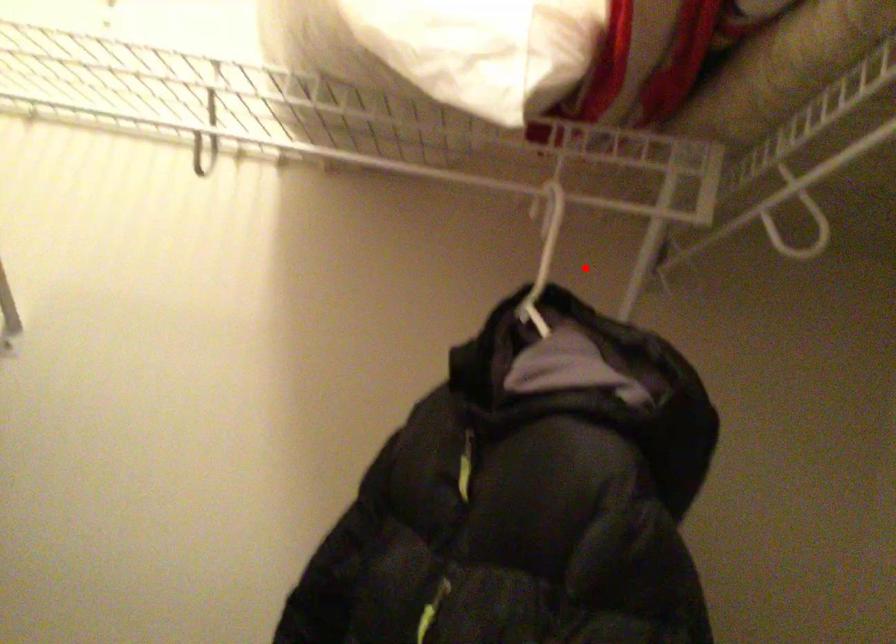
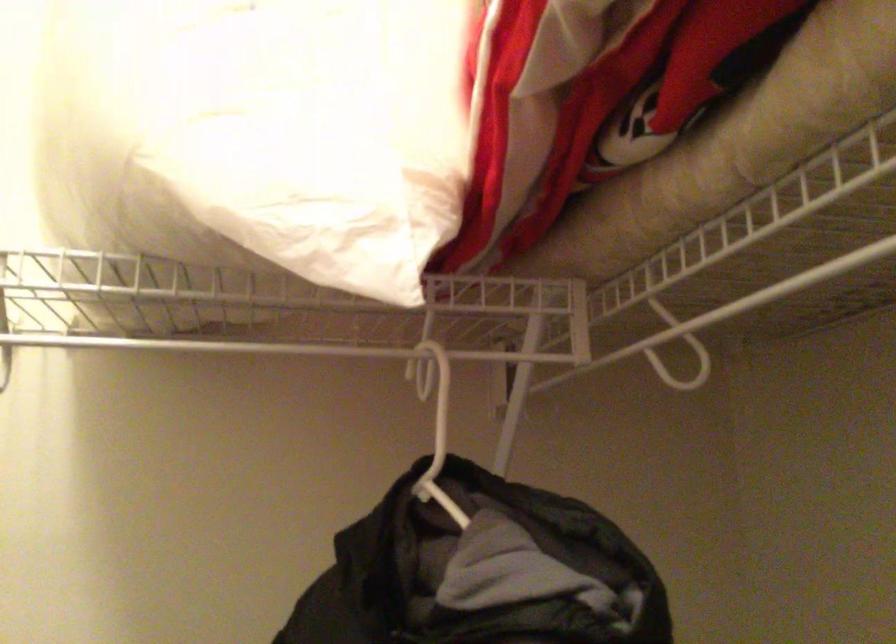
Find the pixel in the second image that matches the highlighted location in the first image.

(436, 404)